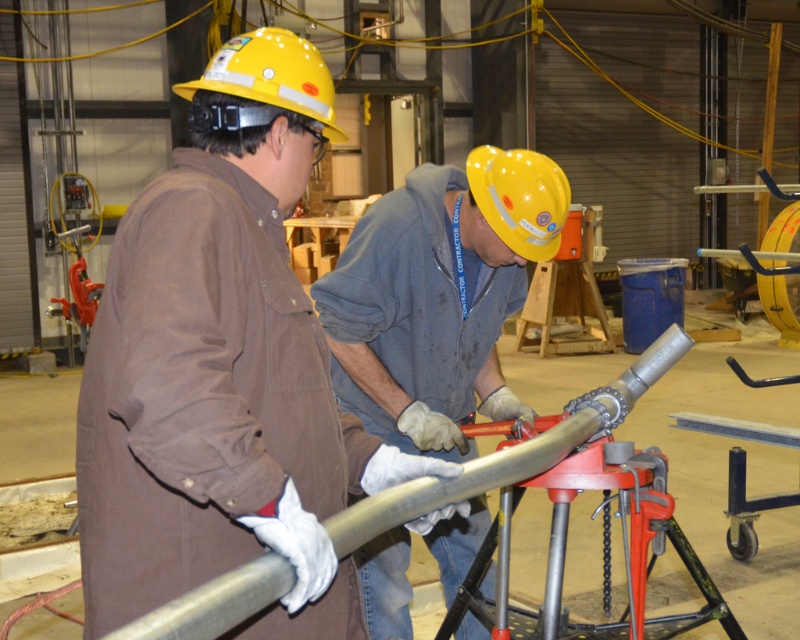
Question: Can you confirm if matte gray pipe at center is positioned above yellow matte hard hat at center?

Choices:
 (A) no
 (B) yes

Answer: (A)

Question: Is yellow hard hat at upper center wider than yellow matte hard hat at center?

Choices:
 (A) no
 (B) yes

Answer: (B)

Question: Among these points, which one is nearest to the camera?

Choices:
 (A) (272, 88)
 (B) (516, 220)

Answer: (A)

Question: Which object appears closest to the camera in this image?

Choices:
 (A) yellow matte hard hat at center
 (B) matte gray pipe at center
 (C) yellow hard hat at upper center

Answer: (C)

Question: Which object is the farthest from the yellow matte hard hat at center?

Choices:
 (A) matte gray pipe at center
 (B) yellow hard hat at upper center

Answer: (B)

Question: Can you confirm if yellow hard hat at upper center is positioned below yellow matte hard hat at center?

Choices:
 (A) yes
 (B) no

Answer: (B)